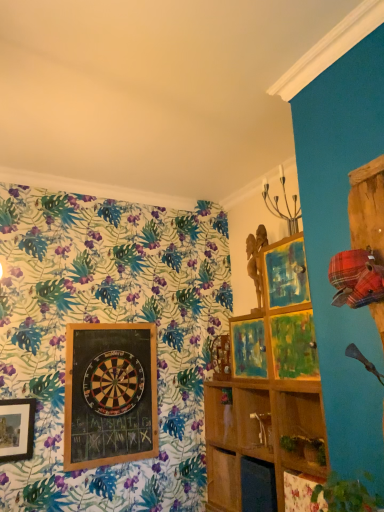
At what (x,y) coordinates should I click in order to perform the action: click on wooden shelf at center, which is counted as the 1th shelf, starting from the back. Please return your answer as a coordinate pair (x, y). Image resolution: width=384 pixels, height=512 pixels. Looking at the image, I should click on (219, 414).

This screenshot has width=384, height=512. What do you see at coordinates (113, 383) in the screenshot?
I see `wooden dartboard at center-left` at bounding box center [113, 383].

Where is `wooden shelf at center, which ranks as the second shelf in back-to-front order`? wooden shelf at center, which ranks as the second shelf in back-to-front order is located at coordinates (260, 434).

Locate an element on the screen. The image size is (384, 512). wooden shelf at center, which is counted as the 1th shelf, starting from the back is located at coordinates (219, 414).

Is wooden shelf at center, which is counted as the 1th shelf, starting from the back, in contact with wooden dartboard at center?

No.

Looking at this image, in terms of size, does wooden shelf at center, which is counted as the 1th shelf, starting from the back, appear bigger or smaller than wooden dartboard at center?

Considering their sizes, wooden shelf at center, which is counted as the 1th shelf, starting from the back, takes up less space than wooden dartboard at center.

From the picture: Is wooden shelf at center, arranged as the second shelf when viewed from the front, facing away from wooden dartboard at center?

No, wooden shelf at center, arranged as the second shelf when viewed from the front, is not facing the opposite direction of wooden dartboard at center.

Who is bigger, wooden dartboard at center-left or wooden shelf at center, which ranks as the second shelf in back-to-front order?

wooden shelf at center, which ranks as the second shelf in back-to-front order, is bigger.

Which object is wider, wooden dartboard at center-left or wooden shelf at center, arranged as the first shelf when viewed from the front?

wooden shelf at center, arranged as the first shelf when viewed from the front, is wider.

From a real-world perspective, is wooden dartboard at center-left beneath wooden shelf at center, which ranks as the second shelf in back-to-front order?

Actually, wooden dartboard at center-left is physically above wooden shelf at center, which ranks as the second shelf in back-to-front order, in the real world.

Can you tell me how much wooden dartboard at center-left and wooden shelf at center, arranged as the first shelf when viewed from the front, differ in facing direction?

The angle between the facing direction of wooden dartboard at center-left and the facing direction of wooden shelf at center, arranged as the first shelf when viewed from the front, is 93.4 degrees.

Considering the relative sizes of wooden shelf at center, arranged as the second shelf when viewed from the front, and wooden dartboard at center-left in the image provided, is wooden shelf at center, arranged as the second shelf when viewed from the front, smaller than wooden dartboard at center-left?

Correct, wooden shelf at center, arranged as the second shelf when viewed from the front, occupies less space than wooden dartboard at center-left.

How distant is wooden shelf at center, arranged as the second shelf when viewed from the front, from wooden dartboard at center-left?

wooden shelf at center, arranged as the second shelf when viewed from the front, is 26.54 inches away from wooden dartboard at center-left.

From a real-world perspective, is wooden shelf at center, which is counted as the 1th shelf, starting from the back, on wooden dartboard at center-left?

Incorrect, from a real-world perspective, wooden shelf at center, which is counted as the 1th shelf, starting from the back, is lower than wooden dartboard at center-left.

Can wooden dartboard at center-left be found inside wooden shelf at center, arranged as the second shelf when viewed from the front?

No, wooden dartboard at center-left is not surrounded by wooden shelf at center, arranged as the second shelf when viewed from the front.

Would you consider wooden shelf at center, arranged as the first shelf when viewed from the front, to be distant from wooden dartboard at center-left?

No, there isn't a large distance between wooden shelf at center, arranged as the first shelf when viewed from the front, and wooden dartboard at center-left.

From a real-world perspective, does wooden shelf at center, which ranks as the second shelf in back-to-front order, stand above wooden dartboard at center-left?

Actually, wooden shelf at center, which ranks as the second shelf in back-to-front order, is physically below wooden dartboard at center-left in the real world.

In terms of height, does wooden shelf at center, arranged as the first shelf when viewed from the front, look taller or shorter compared to wooden dartboard at center-left?

wooden shelf at center, arranged as the first shelf when viewed from the front, is taller than wooden dartboard at center-left.

Is wooden shelf at center, which ranks as the second shelf in back-to-front order, oriented away from wooden dartboard at center-left?

That's not correct — wooden shelf at center, which ranks as the second shelf in back-to-front order, is not looking away from wooden dartboard at center-left.

Visually, is wooden shelf at center, which ranks as the second shelf in back-to-front order, positioned to the left or to the right of wooden shelf at center, which is counted as the 1th shelf, starting from the back?

From the image, it's evident that wooden shelf at center, which ranks as the second shelf in back-to-front order, is to the right of wooden shelf at center, which is counted as the 1th shelf, starting from the back.

Is wooden shelf at center, which ranks as the second shelf in back-to-front order, turned away from wooden shelf at center, which is counted as the 1th shelf, starting from the back?

Yes, wooden shelf at center, which ranks as the second shelf in back-to-front order,'s orientation is away from wooden shelf at center, which is counted as the 1th shelf, starting from the back.

Which of these two, wooden shelf at center, which ranks as the second shelf in back-to-front order, or wooden shelf at center, which is counted as the 1th shelf, starting from the back, is smaller?

Smaller between the two is wooden shelf at center, which is counted as the 1th shelf, starting from the back.

Considering their positions, is wooden shelf at center, which ranks as the second shelf in back-to-front order, located in front of or behind wooden shelf at center, which is counted as the 1th shelf, starting from the back?

In the image, wooden shelf at center, which ranks as the second shelf in back-to-front order, appears in front of wooden shelf at center, which is counted as the 1th shelf, starting from the back.

Consider the image. Is wooden dartboard at center to the left of wooden dartboard at center-left from the viewer's perspective?

Correct, you'll find wooden dartboard at center to the left of wooden dartboard at center-left.

Between point (107, 347) and point (144, 384), which one is positioned behind?

Point (144, 384)

Is wooden dartboard at center oriented towards wooden dartboard at center-left?

Yes, wooden dartboard at center is oriented towards wooden dartboard at center-left.

Can you see wooden dartboard at center touching wooden dartboard at center-left?

Yes, wooden dartboard at center is with wooden dartboard at center-left.

Considering the sizes of objects wooden shelf at center, arranged as the first shelf when viewed from the front, and wooden dartboard at center in the image provided, who is smaller, wooden shelf at center, arranged as the first shelf when viewed from the front, or wooden dartboard at center?

Smaller between the two is wooden dartboard at center.

Are wooden shelf at center, which ranks as the second shelf in back-to-front order, and wooden dartboard at center located far from each other?

Actually, wooden shelf at center, which ranks as the second shelf in back-to-front order, and wooden dartboard at center are a little close together.

Can we say wooden shelf at center, arranged as the first shelf when viewed from the front, lies outside wooden dartboard at center?

wooden shelf at center, arranged as the first shelf when viewed from the front, is positioned outside wooden dartboard at center.

Identify the location of picture frame that appears behind the wooden shelf at center, arranged as the first shelf when viewed from the front. This screenshot has height=512, width=384. (110, 394).

In order to click on picture frame located on the left of wooden shelf at center, arranged as the second shelf when viewed from the front in this screenshot , I will do `click(110, 394)`.

The image size is (384, 512). Identify the location of shelf in front of the wooden dartboard at center-left. (260, 434).

Based on their spatial positions, is wooden dartboard at center-left or wooden dartboard at center further from wooden shelf at center, which ranks as the second shelf in back-to-front order?

wooden dartboard at center-left is further to wooden shelf at center, which ranks as the second shelf in back-to-front order.

When comparing their distances from wooden shelf at center, arranged as the second shelf when viewed from the front, does wooden dartboard at center-left or wooden dartboard at center seem further?

wooden dartboard at center is further to wooden shelf at center, arranged as the second shelf when viewed from the front.

Estimate the real-world distances between objects in this image. Which object is closer to wooden dartboard at center-left, wooden dartboard at center or wooden shelf at center, arranged as the second shelf when viewed from the front?

wooden dartboard at center is closer to wooden dartboard at center-left.

Estimate the real-world distances between objects in this image. Which object is closer to wooden dartboard at center, wooden shelf at center, arranged as the second shelf when viewed from the front, or wooden shelf at center, which ranks as the second shelf in back-to-front order?

wooden shelf at center, arranged as the second shelf when viewed from the front, is positioned closer to the anchor wooden dartboard at center.

Considering their positions, is wooden shelf at center, which ranks as the second shelf in back-to-front order, positioned further to wooden shelf at center, arranged as the second shelf when viewed from the front, than wooden dartboard at center?

Based on the image, wooden dartboard at center appears to be further to wooden shelf at center, arranged as the second shelf when viewed from the front.

Consider the image. Which object lies further to the anchor point wooden dartboard at center, wooden shelf at center, which ranks as the second shelf in back-to-front order, or wooden dartboard at center-left?

wooden shelf at center, which ranks as the second shelf in back-to-front order, is positioned further to the anchor wooden dartboard at center.

Estimate the real-world distances between objects in this image. Which object is further from wooden shelf at center, arranged as the first shelf when viewed from the front, wooden shelf at center, which is counted as the 1th shelf, starting from the back, or wooden dartboard at center-left?

The object further to wooden shelf at center, arranged as the first shelf when viewed from the front, is wooden dartboard at center-left.

Estimate the real-world distances between objects in this image. Which object is closer to wooden dartboard at center-left, wooden shelf at center, which is counted as the 1th shelf, starting from the back, or wooden shelf at center, arranged as the first shelf when viewed from the front?

The object closer to wooden dartboard at center-left is wooden shelf at center, which is counted as the 1th shelf, starting from the back.

In order to click on design situated between wooden dartboard at center and wooden shelf at center, arranged as the second shelf when viewed from the front, from left to right in this screenshot , I will do `click(113, 383)`.

Image resolution: width=384 pixels, height=512 pixels. Identify the location of shelf between wooden dartboard at center-left and wooden shelf at center, which ranks as the second shelf in back-to-front order, in the horizontal direction. (219, 414).

Locate an element on the screen. This screenshot has height=512, width=384. design located between wooden dartboard at center and wooden shelf at center, arranged as the first shelf when viewed from the front, in the left-right direction is located at coordinates (113, 383).

Where is `shelf situated between wooden dartboard at center and wooden shelf at center, which ranks as the second shelf in back-to-front order, from left to right`? This screenshot has height=512, width=384. shelf situated between wooden dartboard at center and wooden shelf at center, which ranks as the second shelf in back-to-front order, from left to right is located at coordinates (219, 414).